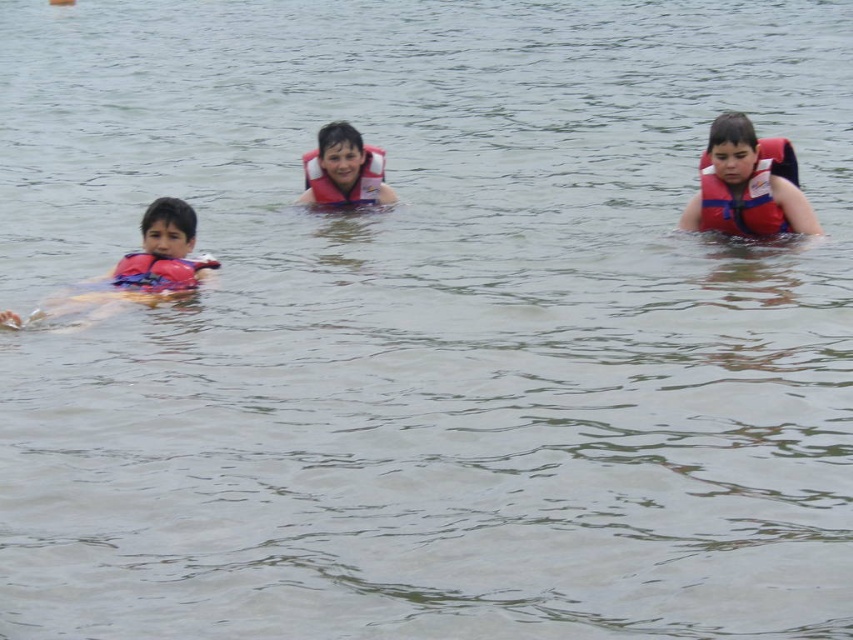
Does red matte life jacket at right appear on the left side of rubber/foam life jacket at left?

In fact, red matte life jacket at right is to the right of rubber/foam life jacket at left.

Is red matte life jacket at right shorter than rubber/foam life jacket at left?

Incorrect, red matte life jacket at right's height does not fall short of rubber/foam life jacket at left's.

What do you see at coordinates (747, 193) in the screenshot? I see `red matte life jacket at right` at bounding box center [747, 193].

I want to click on red matte life jacket at right, so click(x=747, y=193).

Is rubber/foam life jacket at left shorter than matte pink life jacket at center?

Indeed, rubber/foam life jacket at left has a lesser height compared to matte pink life jacket at center.

Is rubber/foam life jacket at left further to camera compared to matte pink life jacket at center?

That is False.

The width and height of the screenshot is (853, 640). I want to click on rubber/foam life jacket at left, so click(x=158, y=273).

The height and width of the screenshot is (640, 853). What are the coordinates of `rubber/foam life jacket at left` in the screenshot? It's located at (158, 273).

Is point (155, 250) closer to viewer compared to point (738, 232)?

Yes, it is.

Describe the element at coordinates (158, 257) in the screenshot. I see `pink foam float at left` at that location.

This screenshot has height=640, width=853. I want to click on pink foam float at left, so click(x=158, y=257).